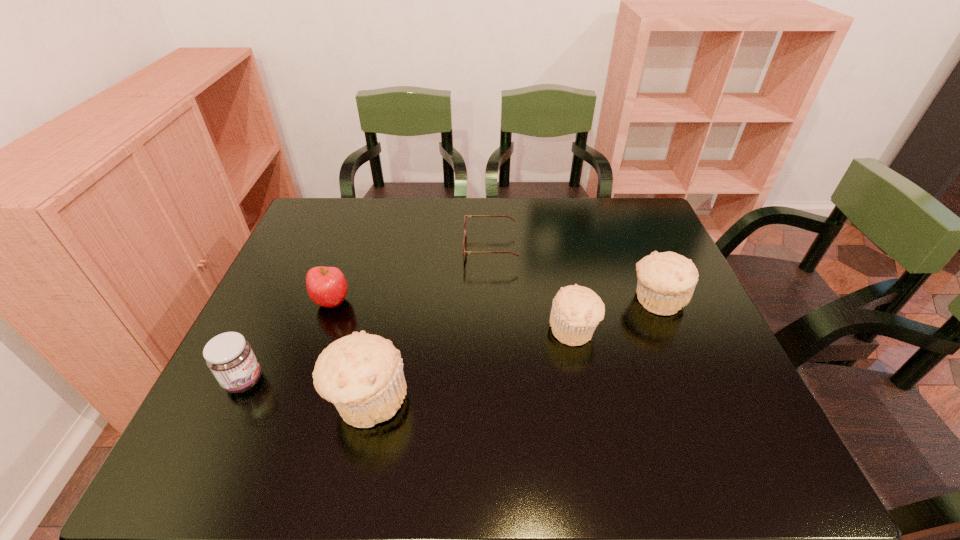
What are the coordinates of `the third object from left to right` in the screenshot? It's located at (362, 374).

This screenshot has height=540, width=960. I want to click on the leftmost muffin, so click(362, 374).

Where is `the second muffin from right to left`? the second muffin from right to left is located at coordinates (576, 311).

In order to click on the shortest muffin in this screenshot , I will do `click(576, 311)`.

The height and width of the screenshot is (540, 960). I want to click on the second shortest muffin, so click(x=666, y=281).

Where is `the rightmost object`? This screenshot has width=960, height=540. the rightmost object is located at coordinates (666, 281).

This screenshot has height=540, width=960. I want to click on apple, so click(326, 286).

Where is `spectacles`? The width and height of the screenshot is (960, 540). spectacles is located at coordinates (465, 236).

Where is `the farthest object`? the farthest object is located at coordinates (465, 236).

This screenshot has height=540, width=960. I want to click on jam, so click(229, 356).